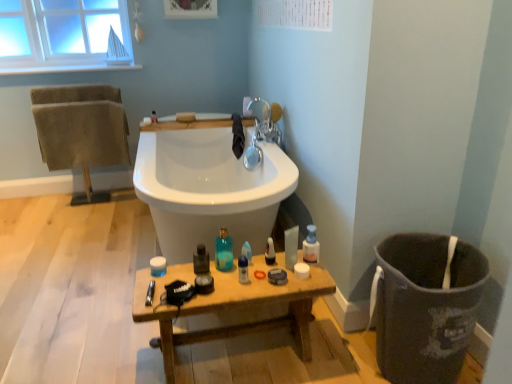
Locate an element on the screen. empty space that is in between blue glossy bottle at center, the 2th mouthwash in the left-to-right sequence, and translucent glass mouthwash at center, placed as the second mouthwash when sorted from right to left is located at coordinates (226, 273).